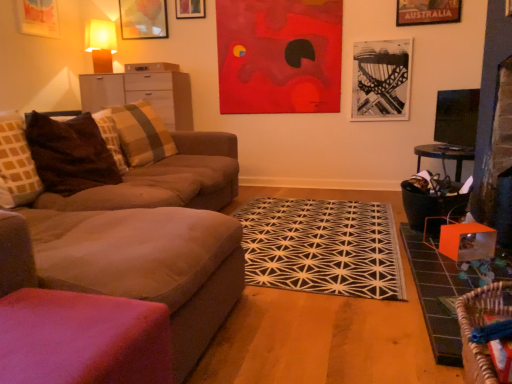
Locate an element on the screen. This screenshot has height=384, width=512. woven wood swivel chair at lower right is located at coordinates (480, 325).

The height and width of the screenshot is (384, 512). What do you see at coordinates (39, 17) in the screenshot?
I see `matte paper picture frame at upper left, which ranks as the fourth picture frame in right-to-left order` at bounding box center [39, 17].

Measure the distance between point (x=131, y=24) and camera.

Point (x=131, y=24) is 4.41 meters away from camera.

Where is `brown textured pillow at left, the 2th pillow in the back-to-front sequence`? brown textured pillow at left, the 2th pillow in the back-to-front sequence is located at coordinates (x=70, y=154).

In order to click on matte white drawer at upper left in this screenshot , I will do `click(152, 67)`.

Between matte white drawer at upper left and plaid fabric pillow at center, which is counted as the first pillow, starting from the back, which one has larger width?

Wider between the two is matte white drawer at upper left.

Is matte white drawer at upper left oriented towards plaid fabric pillow at center, which ranks as the 2th pillow in front-to-back order?

No.

Where is `drawer behind the plaid fabric pillow at center, which ranks as the 2th pillow in front-to-back order`? This screenshot has width=512, height=384. drawer behind the plaid fabric pillow at center, which ranks as the 2th pillow in front-to-back order is located at coordinates (152, 67).

From the image's perspective, is matte white drawer at upper left above plaid fabric pillow at center, which ranks as the 2th pillow in front-to-back order?

Yes, from the image's perspective, matte white drawer at upper left is above plaid fabric pillow at center, which ranks as the 2th pillow in front-to-back order.

Could you tell me if matte orange lampshade at upper left is facing black and white abstract art at upper right, which is counted as the 1th picture frame, starting from the right?

No, matte orange lampshade at upper left is not oriented towards black and white abstract art at upper right, which is counted as the 1th picture frame, starting from the right.

Who is bigger, matte orange lampshade at upper left or black and white abstract art at upper right, which is counted as the 1th picture frame, starting from the right?

matte orange lampshade at upper left.

Is the depth of matte orange lampshade at upper left less than that of black and white abstract art at upper right, the fourth picture frame viewed from the left?

No.

How distant is matte white drawer at upper left from matte paper picture frame at upper left, positioned as the 1th picture frame in left-to-right order?

matte white drawer at upper left is 36.44 inches away from matte paper picture frame at upper left, positioned as the 1th picture frame in left-to-right order.

Which is more to the left, matte white drawer at upper left or matte paper picture frame at upper left, which ranks as the fourth picture frame in right-to-left order?

matte paper picture frame at upper left, which ranks as the fourth picture frame in right-to-left order.

From a real-world perspective, is matte white drawer at upper left physically above matte paper picture frame at upper left, which ranks as the fourth picture frame in right-to-left order?

Actually, matte white drawer at upper left is physically below matte paper picture frame at upper left, which ranks as the fourth picture frame in right-to-left order, in the real world.

Considering the sizes of matte white drawer at upper left and matte paper picture frame at upper left, positioned as the 1th picture frame in left-to-right order, in the image, is matte white drawer at upper left wider or thinner than matte paper picture frame at upper left, positioned as the 1th picture frame in left-to-right order,?

In the image, matte white drawer at upper left appears to be wider than matte paper picture frame at upper left, positioned as the 1th picture frame in left-to-right order.

Considering the relative positions of matte paper picture frame at upper left, positioned as the 1th picture frame in left-to-right order, and matte glass picture frame at upper left, which appears as the 2th picture frame when viewed from the left, in the image provided, is matte paper picture frame at upper left, positioned as the 1th picture frame in left-to-right order, to the left of matte glass picture frame at upper left, which appears as the 2th picture frame when viewed from the left, from the viewer's perspective?

Correct, you'll find matte paper picture frame at upper left, positioned as the 1th picture frame in left-to-right order, to the left of matte glass picture frame at upper left, which appears as the 2th picture frame when viewed from the left.

From a real-world perspective, is matte paper picture frame at upper left, positioned as the 1th picture frame in left-to-right order, above or below matte glass picture frame at upper left, which is the 3th picture frame from right to left?

From a real-world perspective, matte paper picture frame at upper left, positioned as the 1th picture frame in left-to-right order, is physically below matte glass picture frame at upper left, which is the 3th picture frame from right to left.

Is point (50, 34) closer or farther from the camera than point (148, 28)?

Point (50, 34).

Is matte glass picture frame at upper left, which is the 3th picture frame from right to left, at the back of matte paper picture frame at upper left, which ranks as the fourth picture frame in right-to-left order?

No, matte paper picture frame at upper left, which ranks as the fourth picture frame in right-to-left order, is not facing away from matte glass picture frame at upper left, which is the 3th picture frame from right to left.

Is woven wood swivel chair at lower right facing away from matte white drawer at upper left?

That's not correct — woven wood swivel chair at lower right is not looking away from matte white drawer at upper left.

From the picture: Between woven wood swivel chair at lower right and matte white drawer at upper left, which one is positioned behind?

matte white drawer at upper left.

From a real-world perspective, which object rests below the other?

woven wood swivel chair at lower right.

Can you confirm if woven wood swivel chair at lower right is wider than matte white drawer at upper left?

Incorrect, the width of woven wood swivel chair at lower right does not surpass that of matte white drawer at upper left.

From the image's perspective, between suede-like beige couch at left, the second studio couch from the back, and orange cardboard box at lower right, who is located below?

orange cardboard box at lower right, from the image's perspective.

The width and height of the screenshot is (512, 384). I want to click on table below the suede-like beige couch at left, the second studio couch from the back (from the image's perspective), so click(x=439, y=293).

Based on the photo, is suede-like beige couch at left, arranged as the first studio couch when viewed from the front, bigger than orange cardboard box at lower right?

Indeed, suede-like beige couch at left, arranged as the first studio couch when viewed from the front, has a larger size compared to orange cardboard box at lower right.

Considering the positions of objects suede-like beige couch at left, arranged as the first studio couch when viewed from the front, and orange cardboard box at lower right in the image provided, who is in front, suede-like beige couch at left, arranged as the first studio couch when viewed from the front, or orange cardboard box at lower right?

suede-like beige couch at left, arranged as the first studio couch when viewed from the front.

Could you tell me if woven wood swivel chair at lower right is facing matte glass picture frame at upper left, which appears as the 2th picture frame when viewed from the left?

No, woven wood swivel chair at lower right is not turned towards matte glass picture frame at upper left, which appears as the 2th picture frame when viewed from the left.

Does woven wood swivel chair at lower right have a greater height compared to matte glass picture frame at upper left, which is the 3th picture frame from right to left?

In fact, woven wood swivel chair at lower right may be shorter than matte glass picture frame at upper left, which is the 3th picture frame from right to left.

Can you confirm if woven wood swivel chair at lower right is thinner than matte glass picture frame at upper left, which appears as the 2th picture frame when viewed from the left?

Incorrect, the width of woven wood swivel chair at lower right is not less than that of matte glass picture frame at upper left, which appears as the 2th picture frame when viewed from the left.

Would you say woven wood swivel chair at lower right is outside matte glass picture frame at upper left, which is the 3th picture frame from right to left?

woven wood swivel chair at lower right lies outside matte glass picture frame at upper left, which is the 3th picture frame from right to left,'s area.

What are the coordinates of `pillow on the right of matte white drawer at upper left` in the screenshot? It's located at (142, 134).

What are the coordinates of `picture frame that is below the matte orange lampshade at upper left (from the image's perspective)` in the screenshot? It's located at (381, 80).

Considering their positions, is orange cardboard box at lower right positioned further to wooden picture frame at upper center, marked as the third picture frame in a left-to-right arrangement, than velvet brown couch at left, marked as the 2th studio couch in a front-to-back arrangement?

orange cardboard box at lower right is positioned further to the anchor wooden picture frame at upper center, marked as the third picture frame in a left-to-right arrangement.

Based on their spatial positions, is velvet brown couch at left, which is the 1th studio couch in back-to-front order, or plaid fabric pillow at center, which is counted as the first pillow, starting from the back, closer to suede-like beige couch at left, arranged as the first studio couch when viewed from the front?

velvet brown couch at left, which is the 1th studio couch in back-to-front order.

Estimate the real-world distances between objects in this image. Which object is closer to black geometric rug at center, matte wood cabinet at left or suede-like beige couch at left, the second studio couch from the back?

Based on the image, suede-like beige couch at left, the second studio couch from the back, appears to be nearer to black geometric rug at center.

Looking at the image, which one is located closer to black and white abstract art at upper right, which is counted as the 1th picture frame, starting from the right, suede-like beige couch at left, the second studio couch from the back, or brown textured pillow at left, the 2th pillow in the back-to-front sequence?

brown textured pillow at left, the 2th pillow in the back-to-front sequence, is closer to black and white abstract art at upper right, which is counted as the 1th picture frame, starting from the right.

Looking at the image, which one is located closer to matte wood cabinet at left, woven wood swivel chair at lower right or matte glass picture frame at upper left, which is the 3th picture frame from right to left?

matte glass picture frame at upper left, which is the 3th picture frame from right to left.

Based on their spatial positions, is plaid fabric pillow at center, which ranks as the 2th pillow in front-to-back order, or matte white drawer at upper left closer to brown textured pillow at left, the 2th pillow in the back-to-front sequence?

plaid fabric pillow at center, which ranks as the 2th pillow in front-to-back order, is closer to brown textured pillow at left, the 2th pillow in the back-to-front sequence.

When comparing their distances from matte wood cabinet at left, does plaid fabric pillow at center, which is counted as the first pillow, starting from the back, or black and white abstract art at upper right, which is counted as the 1th picture frame, starting from the right, seem closer?

plaid fabric pillow at center, which is counted as the first pillow, starting from the back, is closer to matte wood cabinet at left.

Based on their spatial positions, is brown textured pillow at left, the 2th pillow in the back-to-front sequence, or matte white drawer at upper left further from matte orange lampshade at upper left?

brown textured pillow at left, the 2th pillow in the back-to-front sequence, is further to matte orange lampshade at upper left.

Identify the location of pattern between suede-like beige couch at left, the second studio couch from the back, and matte orange lampshade at upper left, along the z-axis. This screenshot has width=512, height=384. (322, 247).

Locate an element on the screen. pattern between velvet brown couch at left, which is the 1th studio couch in back-to-front order, and woven wood swivel chair at lower right, in the horizontal direction is located at coordinates (322, 247).

Where is `studio couch between suede-like beige couch at left, arranged as the first studio couch when viewed from the front, and matte white drawer at upper left from front to back`? studio couch between suede-like beige couch at left, arranged as the first studio couch when viewed from the front, and matte white drawer at upper left from front to back is located at coordinates (138, 176).

Locate an element on the screen. The width and height of the screenshot is (512, 384). studio couch located between orange cardboard box at lower right and matte wood cabinet at left in the depth direction is located at coordinates (138, 176).